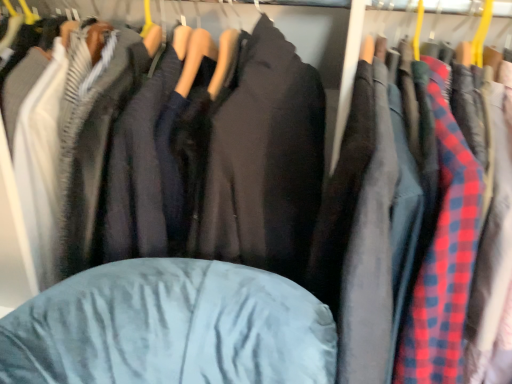
Question: Does velvet blue bean bag at center have a greater height compared to red plaid shirt at center?

Choices:
 (A) yes
 (B) no

Answer: (B)

Question: Is velvet blue bean bag at center shorter than red plaid shirt at center?

Choices:
 (A) yes
 (B) no

Answer: (A)

Question: Is velvet blue bean bag at center smaller than red plaid shirt at center?

Choices:
 (A) yes
 (B) no

Answer: (A)

Question: Is velvet blue bean bag at center completely or partially outside of red plaid shirt at center?

Choices:
 (A) yes
 (B) no

Answer: (A)

Question: From a real-world perspective, does velvet blue bean bag at center stand above red plaid shirt at center?

Choices:
 (A) no
 (B) yes

Answer: (A)

Question: From a real-world perspective, is velvet blue jacket at center above or below velvet blue bean bag at center?

Choices:
 (A) above
 (B) below

Answer: (A)

Question: Do you think velvet blue jacket at center is within velvet blue bean bag at center, or outside of it?

Choices:
 (A) inside
 (B) outside

Answer: (B)

Question: From the image's perspective, is velvet blue jacket at center located above or below velvet blue bean bag at center?

Choices:
 (A) above
 (B) below

Answer: (A)

Question: In terms of height, does velvet blue jacket at center look taller or shorter compared to velvet blue bean bag at center?

Choices:
 (A) short
 (B) tall

Answer: (B)

Question: Is red plaid shirt at center to the left or to the right of velvet blue jacket at center in the image?

Choices:
 (A) left
 (B) right

Answer: (B)

Question: Looking at the image, does red plaid shirt at center seem bigger or smaller compared to velvet blue jacket at center?

Choices:
 (A) small
 (B) big

Answer: (B)

Question: From the image's perspective, is red plaid shirt at center positioned above or below velvet blue jacket at center?

Choices:
 (A) below
 (B) above

Answer: (A)

Question: Is point (348, 297) closer or farther from the camera than point (224, 178)?

Choices:
 (A) farther
 (B) closer

Answer: (B)

Question: Do you think velvet blue bean bag at center is within velvet blue jacket at center, or outside of it?

Choices:
 (A) outside
 (B) inside

Answer: (A)

Question: Would you say velvet blue bean bag at center is to the left or to the right of velvet blue jacket at center in the picture?

Choices:
 (A) left
 (B) right

Answer: (B)